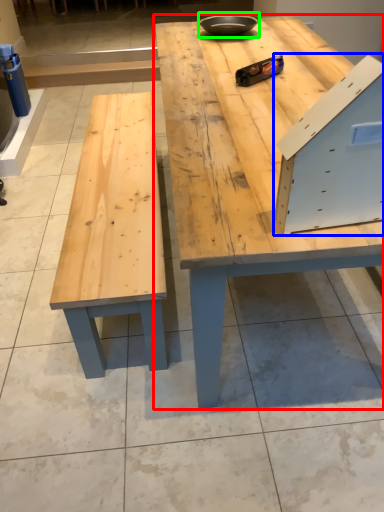
Question: Based on their relative distances, which object is farther from table (highlighted by a red box)? Choose from drawer (highlighted by a blue box) and bowl (highlighted by a green box).

Choices:
 (A) drawer
 (B) bowl

Answer: (B)